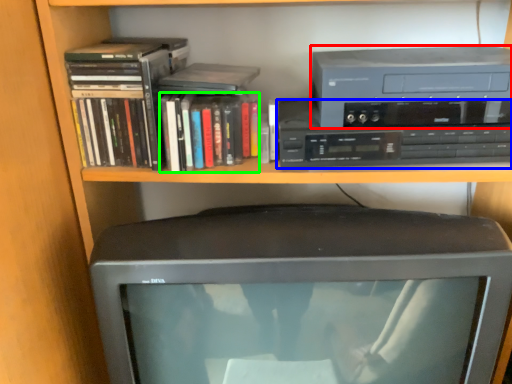
Question: Which object is positioned closest to cassette (highlighted by a red box)? Select from cassette (highlighted by a blue box) and book (highlighted by a green box).

Choices:
 (A) cassette
 (B) book

Answer: (A)